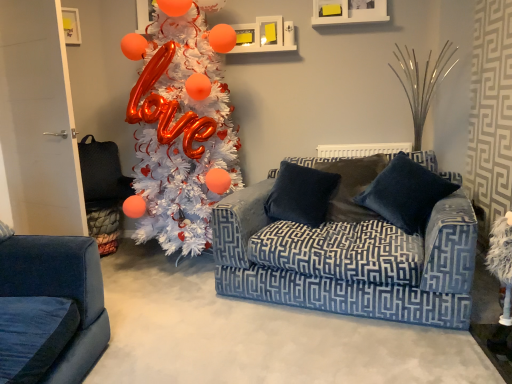
What do you see at coordinates (349, 255) in the screenshot? I see `velvet blue couch at center` at bounding box center [349, 255].

Image resolution: width=512 pixels, height=384 pixels. What are the coordinates of `velvet dark blue pillow at center, placed as the 2th pillow when sorted from left to right` in the screenshot? It's located at (405, 194).

From the image's perspective, which object appears higher, velvet dark blue pillow at center, which is the first pillow from right to left, or velvet dark blue pillow at center, the 1th pillow in the left-to-right sequence?

From the image's view, velvet dark blue pillow at center, which is the first pillow from right to left, is above.

Which is nearer, (404, 211) or (307, 196)?

The point (404, 211) is closer.

Is velvet dark blue pillow at center, placed as the 2th pillow when sorted from left to right, oriented away from velvet dark blue pillow at center, acting as the 2th pillow starting from the right?

That's not correct — velvet dark blue pillow at center, placed as the 2th pillow when sorted from left to right, is not looking away from velvet dark blue pillow at center, acting as the 2th pillow starting from the right.

Which of these two, velvet dark blue pillow at center, which is the first pillow from right to left, or velvet dark blue pillow at center, acting as the 2th pillow starting from the right, is smaller?

velvet dark blue pillow at center, acting as the 2th pillow starting from the right.

Is white matte christmas tree at left with velvet blue couch at center?

No, white matte christmas tree at left is not beside velvet blue couch at center.

Which object is further away from the camera, white matte christmas tree at left or velvet blue couch at center?

white matte christmas tree at left is further away from the camera.

From the picture: Which object is positioned more to the left, white matte christmas tree at left or velvet blue couch at center?

From the viewer's perspective, white matte christmas tree at left appears more on the left side.

Does white matte christmas tree at left have a smaller size compared to velvet blue couch at center?

Actually, white matte christmas tree at left might be larger than velvet blue couch at center.

Does velvet dark blue pillow at center, the 1th pillow in the left-to-right sequence, appear on the left side of velvet blue couch at center?

Indeed, velvet dark blue pillow at center, the 1th pillow in the left-to-right sequence, is positioned on the left side of velvet blue couch at center.

Measure the distance from velvet dark blue pillow at center, acting as the 2th pillow starting from the right, to velvet blue couch at center.

The distance of velvet dark blue pillow at center, acting as the 2th pillow starting from the right, from velvet blue couch at center is 11.91 inches.

In the scene shown: From the image's perspective, which one is positioned higher, velvet dark blue pillow at center, acting as the 2th pillow starting from the right, or velvet blue couch at center?

velvet dark blue pillow at center, acting as the 2th pillow starting from the right.

Who is taller, velvet dark blue pillow at center, the 1th pillow in the left-to-right sequence, or velvet blue couch at center?

velvet blue couch at center.

Considering the positions of objects velvet blue couch at center and velvet dark blue pillow at center, which is the first pillow from right to left, in the image provided, who is behind, velvet blue couch at center or velvet dark blue pillow at center, which is the first pillow from right to left,?

velvet dark blue pillow at center, which is the first pillow from right to left, is more distant.

Considering the sizes of velvet blue couch at center and velvet dark blue pillow at center, which is the first pillow from right to left, in the image, is velvet blue couch at center taller or shorter than velvet dark blue pillow at center, which is the first pillow from right to left,?

velvet blue couch at center is taller than velvet dark blue pillow at center, which is the first pillow from right to left.

In the scene shown: Which of these two, velvet blue couch at center or velvet dark blue pillow at center, which is the first pillow from right to left, is bigger?

velvet blue couch at center is bigger.

What's the angular difference between velvet blue couch at center and velvet dark blue pillow at center, which is the first pillow from right to left,'s facing directions?

velvet blue couch at center and velvet dark blue pillow at center, which is the first pillow from right to left, are facing 0.000805 degrees away from each other.

Is velvet dark blue pillow at center, the 1th pillow in the left-to-right sequence, next to velvet dark blue pillow at center, which is the first pillow from right to left?

They are not placed beside each other.

From their relative heights in the image, would you say velvet dark blue pillow at center, the 1th pillow in the left-to-right sequence, is taller or shorter than velvet dark blue pillow at center, which is the first pillow from right to left?

velvet dark blue pillow at center, the 1th pillow in the left-to-right sequence, is shorter than velvet dark blue pillow at center, which is the first pillow from right to left.

Can you confirm if velvet dark blue pillow at center, the 1th pillow in the left-to-right sequence, is positioned to the right of velvet dark blue pillow at center, which is the first pillow from right to left?

No.

Does velvet blue couch at center have a larger size compared to velvet dark blue pillow at center, the 1th pillow in the left-to-right sequence?

Yes, velvet blue couch at center is bigger than velvet dark blue pillow at center, the 1th pillow in the left-to-right sequence.

From the image's perspective, would you say velvet blue couch at center is shown under velvet dark blue pillow at center, acting as the 2th pillow starting from the right?

Yes, from the image's perspective, velvet blue couch at center is below velvet dark blue pillow at center, acting as the 2th pillow starting from the right.

Is velvet blue couch at center positioned with its back to velvet dark blue pillow at center, acting as the 2th pillow starting from the right?

That's right, velvet blue couch at center is facing away from velvet dark blue pillow at center, acting as the 2th pillow starting from the right.

Is velvet dark blue pillow at center, the 1th pillow in the left-to-right sequence, bigger or smaller than white matte christmas tree at left?

velvet dark blue pillow at center, the 1th pillow in the left-to-right sequence, is smaller than white matte christmas tree at left.

Is velvet dark blue pillow at center, acting as the 2th pillow starting from the right, to the left or to the right of white matte christmas tree at left in the image?

velvet dark blue pillow at center, acting as the 2th pillow starting from the right, is to the right of white matte christmas tree at left.

Considering the positions of point (318, 207) and point (140, 50), is point (318, 207) closer or farther from the camera than point (140, 50)?

Point (318, 207).

Which object is closer to the camera, velvet dark blue pillow at center, acting as the 2th pillow starting from the right, or white matte christmas tree at left?

white matte christmas tree at left.

Locate an element on the screen. This screenshot has width=512, height=384. pillow that appears behind the velvet dark blue pillow at center, which is the first pillow from right to left is located at coordinates (301, 194).

Locate an element on the screen. The height and width of the screenshot is (384, 512). studio couch below the white matte christmas tree at left (from the image's perspective) is located at coordinates (349, 255).

Considering their positions, is velvet dark blue pillow at center, the 1th pillow in the left-to-right sequence, positioned closer to white matte christmas tree at left than velvet blue couch at center?

The object closer to white matte christmas tree at left is velvet dark blue pillow at center, the 1th pillow in the left-to-right sequence.

Looking at the image, which one is located further to velvet dark blue pillow at center, placed as the 2th pillow when sorted from left to right, velvet dark blue pillow at center, acting as the 2th pillow starting from the right, or white matte christmas tree at left?

Among the two, white matte christmas tree at left is located further to velvet dark blue pillow at center, placed as the 2th pillow when sorted from left to right.

When comparing their distances from velvet dark blue pillow at center, which is the first pillow from right to left, does white matte christmas tree at left or velvet dark blue pillow at center, acting as the 2th pillow starting from the right, seem closer?

Based on the image, velvet dark blue pillow at center, acting as the 2th pillow starting from the right, appears to be nearer to velvet dark blue pillow at center, which is the first pillow from right to left.

Based on their spatial positions, is white matte christmas tree at left or velvet dark blue pillow at center, which is the first pillow from right to left, closer to velvet dark blue pillow at center, acting as the 2th pillow starting from the right?

The object closer to velvet dark blue pillow at center, acting as the 2th pillow starting from the right, is velvet dark blue pillow at center, which is the first pillow from right to left.

From the image, which object appears to be farther from velvet dark blue pillow at center, acting as the 2th pillow starting from the right, velvet blue couch at center or velvet dark blue pillow at center, placed as the 2th pillow when sorted from left to right?

Based on the image, velvet dark blue pillow at center, placed as the 2th pillow when sorted from left to right, appears to be further to velvet dark blue pillow at center, acting as the 2th pillow starting from the right.

When comparing their distances from velvet dark blue pillow at center, which is the first pillow from right to left, does velvet blue couch at center or white matte christmas tree at left seem closer?

Based on the image, velvet blue couch at center appears to be nearer to velvet dark blue pillow at center, which is the first pillow from right to left.

Estimate the real-world distances between objects in this image. Which object is closer to white matte christmas tree at left, velvet blue couch at center or velvet dark blue pillow at center, the 1th pillow in the left-to-right sequence?

velvet dark blue pillow at center, the 1th pillow in the left-to-right sequence.

Which object lies further to the anchor point white matte christmas tree at left, velvet blue couch at center or velvet dark blue pillow at center, placed as the 2th pillow when sorted from left to right?

velvet dark blue pillow at center, placed as the 2th pillow when sorted from left to right, lies further to white matte christmas tree at left than the other object.

Identify the location of pillow between white matte christmas tree at left and velvet dark blue pillow at center, placed as the 2th pillow when sorted from left to right, from left to right. The height and width of the screenshot is (384, 512). (301, 194).

At what (x,y) coordinates should I click in order to perform the action: click on studio couch between velvet dark blue pillow at center, acting as the 2th pillow starting from the right, and velvet dark blue pillow at center, placed as the 2th pillow when sorted from left to right. Please return your answer as a coordinate pair (x, y). This screenshot has width=512, height=384. Looking at the image, I should click on (349, 255).

Locate an element on the screen. Image resolution: width=512 pixels, height=384 pixels. pillow between white matte christmas tree at left and velvet blue couch at center in the horizontal direction is located at coordinates (301, 194).

Find the location of a particular element. The width and height of the screenshot is (512, 384). studio couch between white matte christmas tree at left and velvet dark blue pillow at center, which is the first pillow from right to left, from left to right is located at coordinates (349, 255).